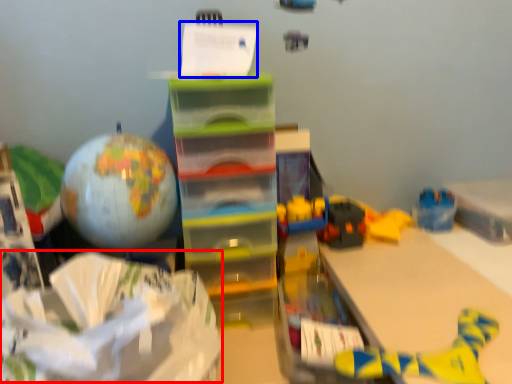
Question: Which point is closer to the camera, wrapping paper (highlighted by a red box) or writing (highlighted by a blue box)?

Choices:
 (A) wrapping paper
 (B) writing

Answer: (A)